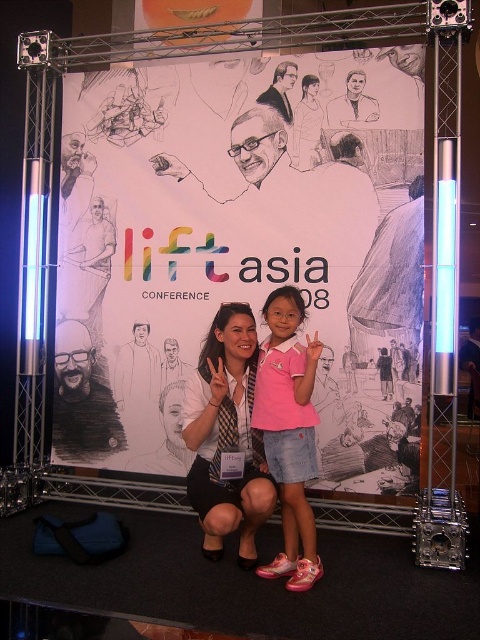
Is matte black blazer at center smaller than pink matte shirt at center?

No, matte black blazer at center is not smaller than pink matte shirt at center.

Does point (254, 504) come in front of point (300, 464)?

Yes, it is.

This screenshot has width=480, height=640. Identify the location of matte black blazer at center. (227, 435).